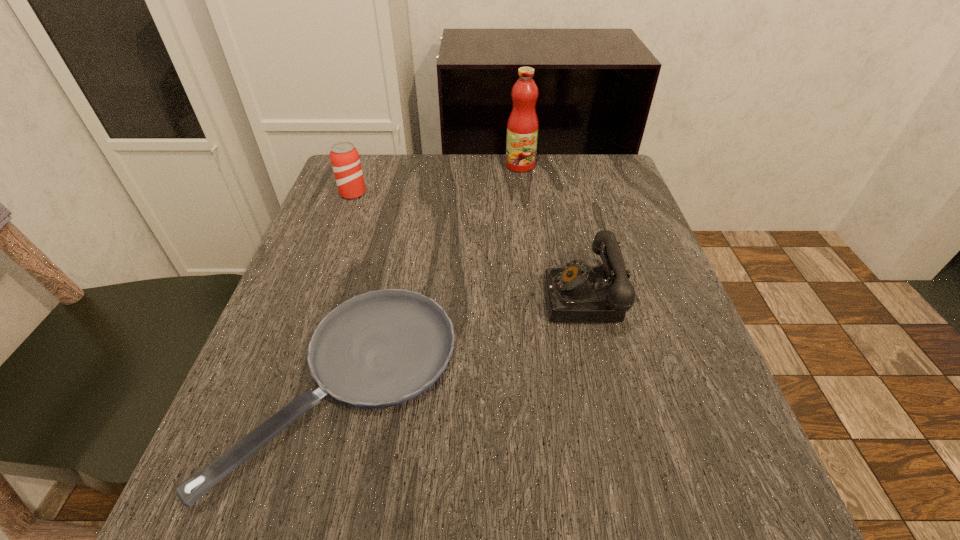
Locate an element on the screen. This screenshot has width=960, height=540. vacant space at the near edge is located at coordinates (444, 477).

The width and height of the screenshot is (960, 540). In the image, there is a desktop. Identify the location of blank space at the left edge. (367, 215).

Where is `vacant space at the right edge`? This screenshot has width=960, height=540. vacant space at the right edge is located at coordinates (641, 265).

Locate an element on the screen. This screenshot has height=540, width=960. vacant space at the near left corner of the desktop is located at coordinates (251, 518).

Locate an element on the screen. vacant point at the far right corner is located at coordinates (589, 174).

The height and width of the screenshot is (540, 960). What are the coordinates of `free spot between the frying pan and the fruit juice` in the screenshot? It's located at (433, 276).

Locate an element on the screen. The image size is (960, 540). free space between the tallest object and the telephone is located at coordinates (553, 232).

I want to click on unoccupied area between the shortest object and the second farthest object, so click(349, 291).

The image size is (960, 540). Find the location of `blank region between the frying pan and the fruit juice`. blank region between the frying pan and the fruit juice is located at coordinates (433, 276).

Find the location of a particular element. This screenshot has height=540, width=960. vacant space in between the tallest object and the telephone is located at coordinates (553, 232).